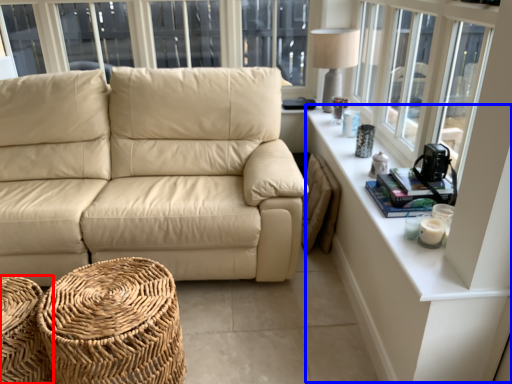
Question: Which object appears farthest to the camera in this image, footrest (highlighted by a red box) or table (highlighted by a blue box)?

Choices:
 (A) footrest
 (B) table

Answer: (A)